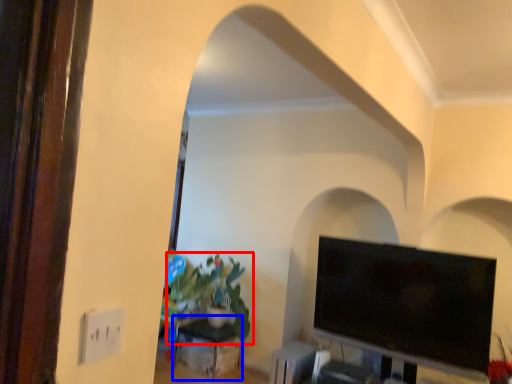
Question: Among these objects, which one is farthest to the camera, houseplant (highlighted by a red box) or table (highlighted by a blue box)?

Choices:
 (A) houseplant
 (B) table

Answer: (B)